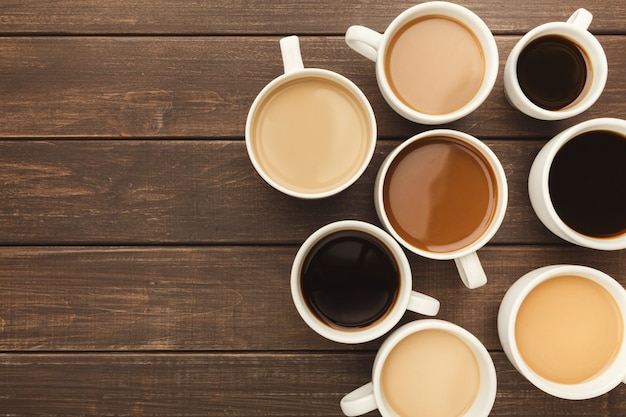
At what (x,y) coordinates should I click in order to perform the action: click on white mug. Please return your answer as a coordinate pair (x, y). The height and width of the screenshot is (417, 626). Looking at the image, I should click on (293, 62), (367, 38), (576, 26), (541, 179), (471, 260), (411, 296), (369, 395), (615, 376).